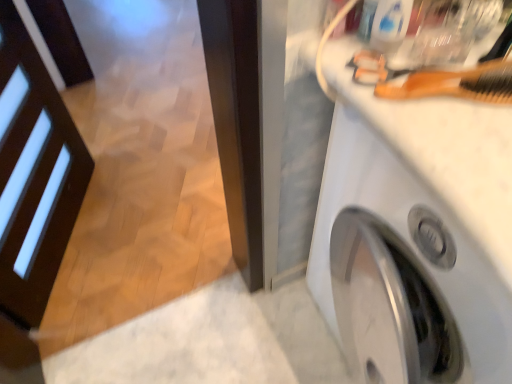
Question: From a real-world perspective, is wooden comb at upper right positioned under white glossy washing machine at upper right based on gravity?

Choices:
 (A) no
 (B) yes

Answer: (A)

Question: Are wooden comb at upper right and white glossy washing machine at upper right far apart?

Choices:
 (A) no
 (B) yes

Answer: (A)

Question: Is wooden comb at upper right bigger than white glossy washing machine at upper right?

Choices:
 (A) yes
 (B) no

Answer: (B)

Question: From a real-world perspective, is wooden comb at upper right located higher than white glossy washing machine at upper right?

Choices:
 (A) yes
 (B) no

Answer: (A)

Question: Does wooden comb at upper right have a greater height compared to white glossy washing machine at upper right?

Choices:
 (A) yes
 (B) no

Answer: (B)

Question: Does wooden comb at upper right have a greater width compared to white glossy washing machine at upper right?

Choices:
 (A) yes
 (B) no

Answer: (B)

Question: Is white glossy washing machine at upper right positioned beyond the bounds of wooden comb at upper right?

Choices:
 (A) yes
 (B) no

Answer: (A)

Question: Are white glossy washing machine at upper right and wooden comb at upper right far apart?

Choices:
 (A) yes
 (B) no

Answer: (B)

Question: Is white glossy washing machine at upper right oriented away from wooden comb at upper right?

Choices:
 (A) no
 (B) yes

Answer: (A)

Question: Does white glossy washing machine at upper right lie behind wooden comb at upper right?

Choices:
 (A) yes
 (B) no

Answer: (B)

Question: Is white glossy washing machine at upper right at the right side of wooden comb at upper right?

Choices:
 (A) no
 (B) yes

Answer: (B)

Question: From the image's perspective, is white glossy washing machine at upper right located beneath wooden comb at upper right?

Choices:
 (A) yes
 (B) no

Answer: (A)

Question: Would you say wooden comb at upper right is to the left or to the right of white glossy washing machine at upper right in the picture?

Choices:
 (A) right
 (B) left

Answer: (B)